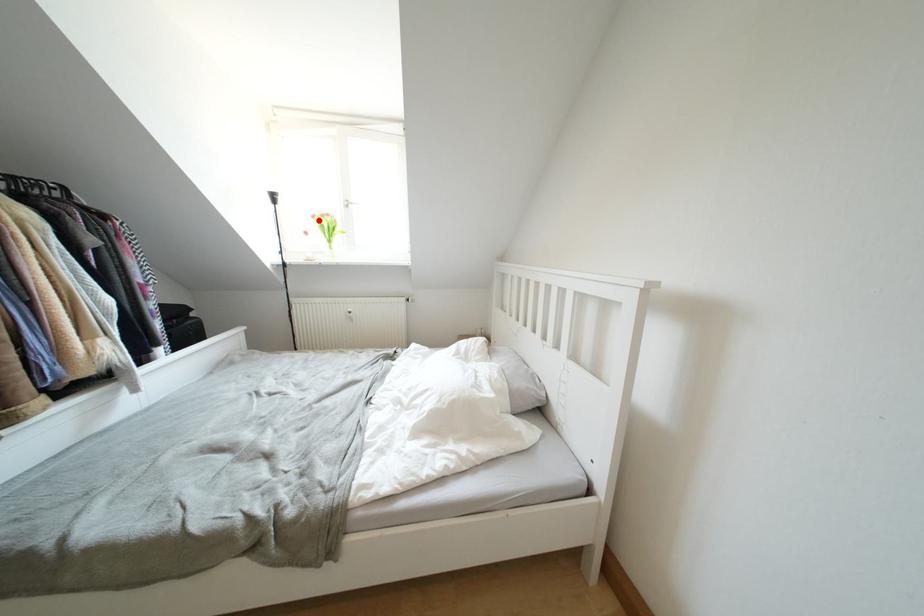
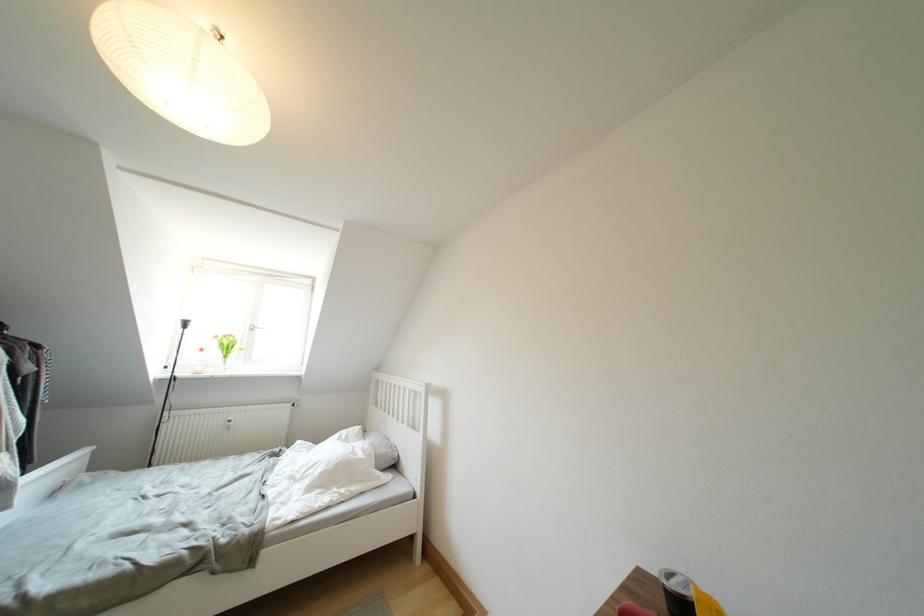
Question: I am providing you with two images of the same scene from different viewpoints. In image1, a red point is highlighted. Considering the same 3D point in image2, which of the following is correct?

Choices:
 (A) It is closer
 (B) It is farther

Answer: (B)